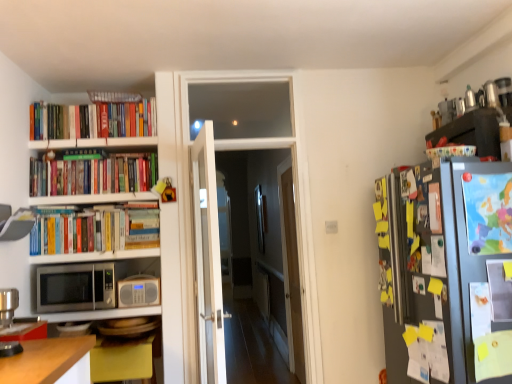
Question: Considering the positions of point (119, 299) and point (303, 370), is point (119, 299) closer or farther from the camera than point (303, 370)?

Choices:
 (A) closer
 (B) farther

Answer: (A)

Question: From the image's perspective, is beige plastic radio at left above or below transparent glass door at center, which is counted as the first glass door, starting from the right?

Choices:
 (A) above
 (B) below

Answer: (A)

Question: Estimate the real-world distances between objects in this image. Which object is farther from the colorful ceramic bowl at upper right?

Choices:
 (A) transparent glass door at center, the first glass door in the back-to-front sequence
 (B) white glass door at center
 (C) beige plastic radio at left
 (D) clear glass door at center, arranged as the first glass door when viewed from the left
 (E) metallic silver coffee machine at lower left

Answer: (D)

Question: Which object is the farthest from the transparent glass door at center, the first glass door in the back-to-front sequence?

Choices:
 (A) clear glass door at center, acting as the 2th glass door starting from the right
 (B) yellow matte table at lower left
 (C) hardcover books at left, placed as the 1th book when sorted from bottom to top
 (D) beige plastic radio at left
 (E) hardcover books at upper left, acting as the second book starting from the bottom

Answer: (E)